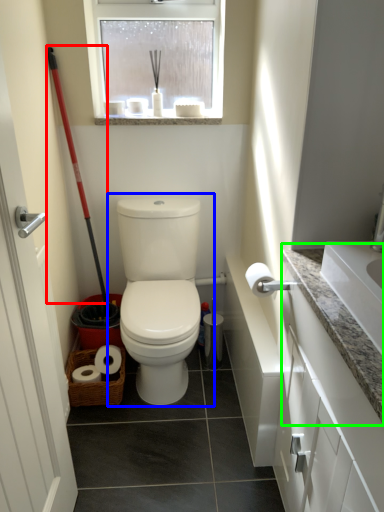
Question: Considering the real-world distances, which object is closest to shovel (highlighted by a red box)? toilet (highlighted by a blue box) or counter top (highlighted by a green box).

Choices:
 (A) toilet
 (B) counter top

Answer: (A)